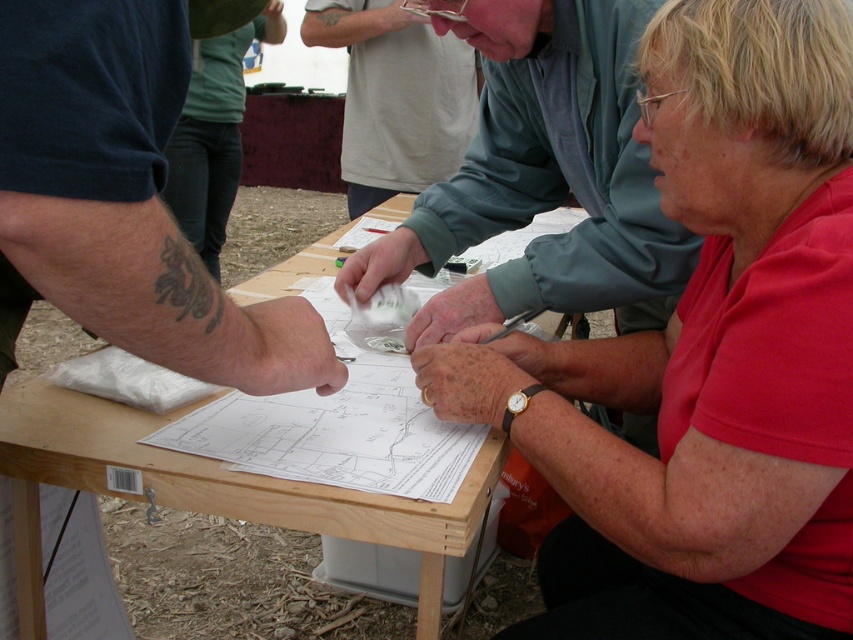
You are standing at the edge of the scene and want to hand a document to the person in the red matte shirt at center. Since you can only approach from the left side of the wooden table at center, will you be able to reach them without moving the table?

The red matte shirt at center is positioned on the right side of the wooden table at center. Since you can only approach from the left side of the table, you would not be able to directly reach the person without moving the table or going around it.

In the scene shown: You are standing in front of the wooden table at center and want to hand a document to the person wearing the red matte shirt at center. Can you directly place the document on the table without needing to move around any obstacles?

The red matte shirt at center is closer to the viewer than the wooden table at center, so you can directly place the document on the wooden table at center without needing to move around any obstacles because the table is behind the person.